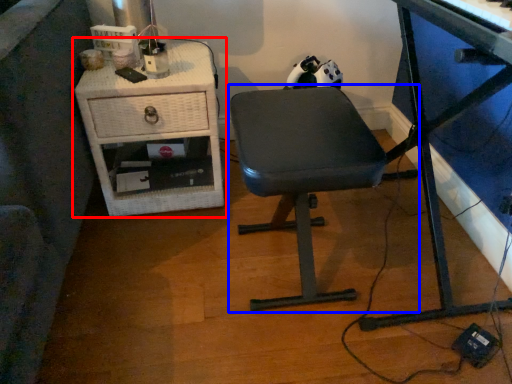
Question: Which point is further to the camera, nightstand (highlighted by a red box) or chair (highlighted by a blue box)?

Choices:
 (A) nightstand
 (B) chair

Answer: (A)